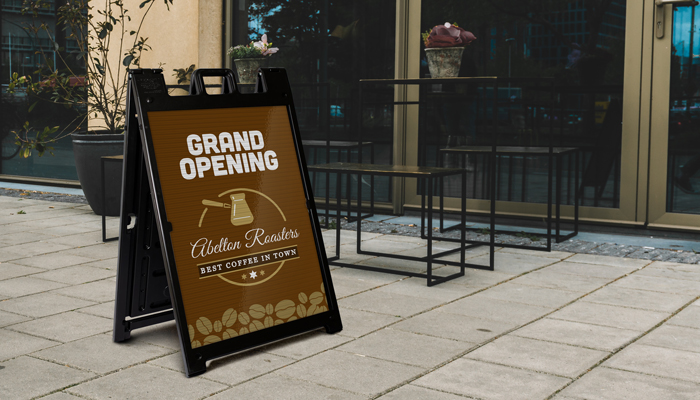
Where is `plant pot`? The height and width of the screenshot is (400, 700). plant pot is located at coordinates (94, 153).